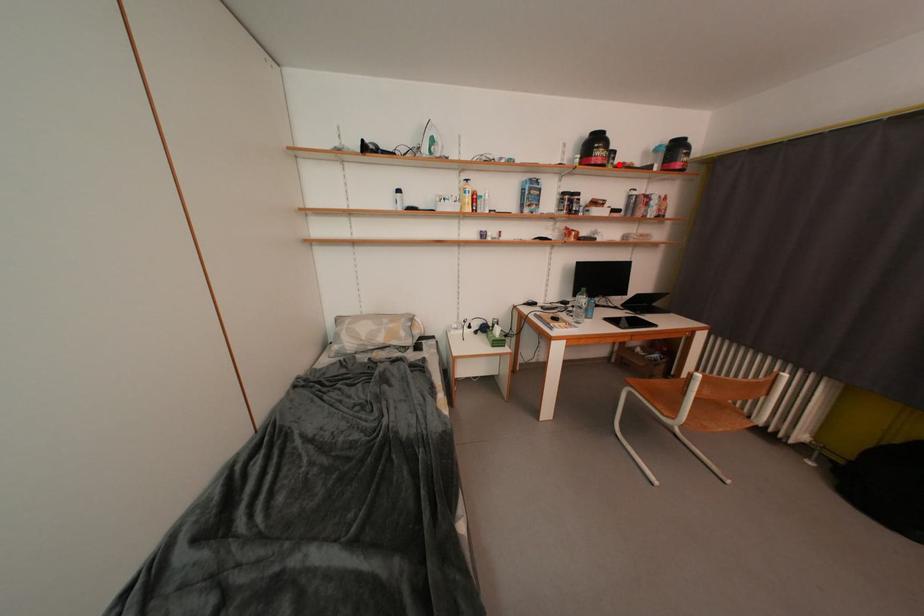
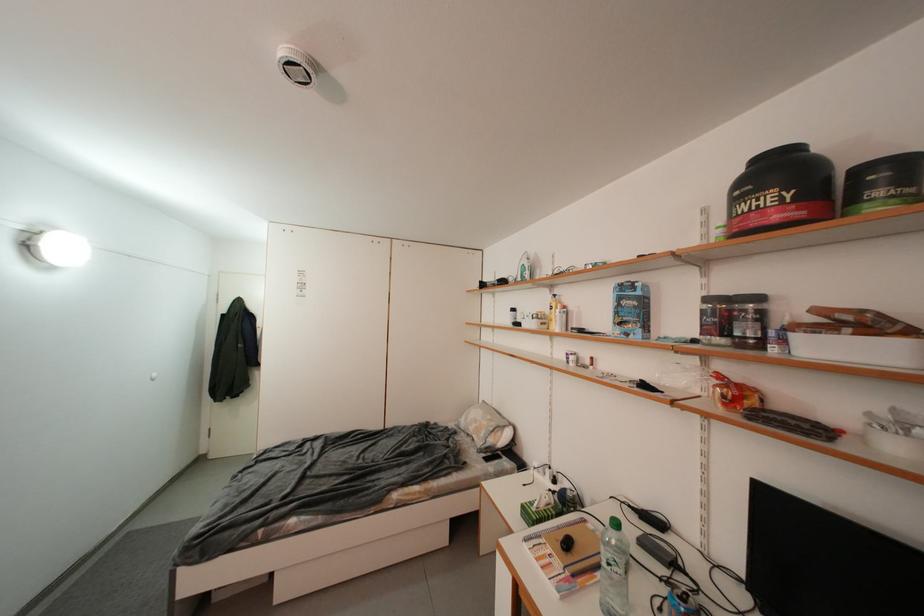
Find the pixel in the second image that matches the highlighted location in the first image.

(886, 196)